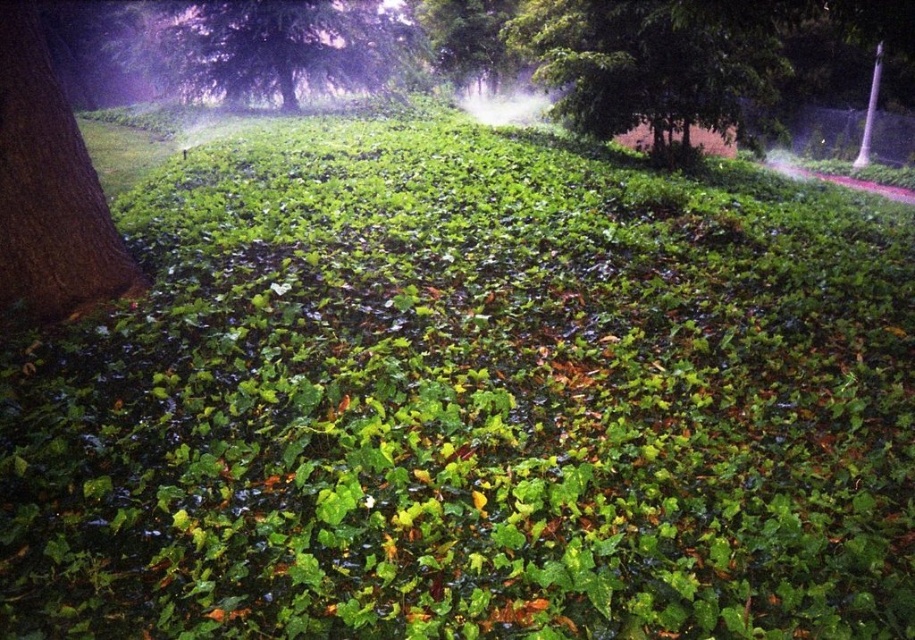
Question: Where is brown rough bark tree at left located in relation to green leafy tree at upper left in the image?

Choices:
 (A) below
 (B) above

Answer: (A)

Question: Estimate the real-world distances between objects in this image. Which object is closer to the green leafy tree at upper left?

Choices:
 (A) brown rough bark tree at left
 (B) green leafy tree at upper center

Answer: (B)

Question: Which point is farther from the camera taking this photo?

Choices:
 (A) (361, 67)
 (B) (84, 275)

Answer: (A)

Question: Is green leafy tree at upper center positioned behind brown rough bark tree at left?

Choices:
 (A) yes
 (B) no

Answer: (A)

Question: Is green leafy tree at upper center to the right of green leafy tree at upper left from the viewer's perspective?

Choices:
 (A) no
 (B) yes

Answer: (B)

Question: Among these points, which one is nearest to the camera?

Choices:
 (A) (583, 74)
 (B) (100, 221)

Answer: (B)